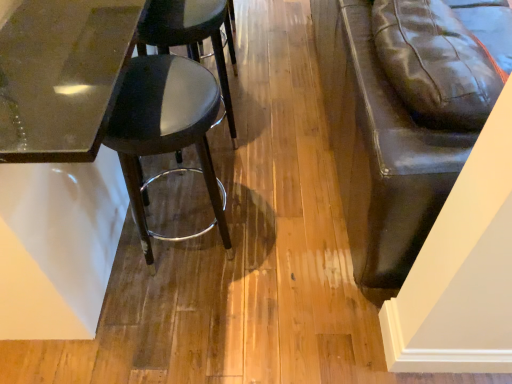
Question: Is the depth of glossy glass table at upper left less than that of matte black stool at left, which is the first stool from bottom to top?

Choices:
 (A) yes
 (B) no

Answer: (A)

Question: Is glossy glass table at upper left bigger than matte black stool at left, which is the first stool from bottom to top?

Choices:
 (A) no
 (B) yes

Answer: (B)

Question: From a real-world perspective, is glossy glass table at upper left beneath matte black stool at left, the 2th stool from the top?

Choices:
 (A) yes
 (B) no

Answer: (B)

Question: Does glossy glass table at upper left have a greater height compared to matte black stool at left, the 2th stool from the top?

Choices:
 (A) no
 (B) yes

Answer: (B)

Question: Is glossy glass table at upper left positioned behind matte black stool at left, the 2th stool from the top?

Choices:
 (A) yes
 (B) no

Answer: (B)

Question: Considering their positions, is black leather stool at center, positioned as the 1th stool in top-to-bottom order, located in front of or behind matte black stool at left, which is the first stool from bottom to top?

Choices:
 (A) behind
 (B) front

Answer: (A)

Question: Looking at the image, does black leather stool at center, positioned as the 1th stool in top-to-bottom order, seem bigger or smaller compared to matte black stool at left, which is the first stool from bottom to top?

Choices:
 (A) big
 (B) small

Answer: (A)

Question: Based on their positions, is black leather stool at center, positioned as the 1th stool in top-to-bottom order, located to the left or right of matte black stool at left, which is the first stool from bottom to top?

Choices:
 (A) left
 (B) right

Answer: (A)

Question: Considering the positions of black leather stool at center, the second stool from the bottom, and matte black stool at left, which is the first stool from bottom to top, in the image, is black leather stool at center, the second stool from the bottom, taller or shorter than matte black stool at left, which is the first stool from bottom to top,?

Choices:
 (A) tall
 (B) short

Answer: (A)

Question: Based on their sizes in the image, would you say black leather stool at center, the second stool from the bottom, is bigger or smaller than glossy glass table at upper left?

Choices:
 (A) big
 (B) small

Answer: (B)

Question: Is black leather stool at center, the second stool from the bottom, wider or thinner than glossy glass table at upper left?

Choices:
 (A) thin
 (B) wide

Answer: (A)

Question: From the image's perspective, is black leather stool at center, positioned as the 1th stool in top-to-bottom order, located above or below glossy glass table at upper left?

Choices:
 (A) above
 (B) below

Answer: (B)

Question: Is black leather stool at center, the second stool from the bottom, situated inside glossy glass table at upper left or outside?

Choices:
 (A) outside
 (B) inside

Answer: (B)

Question: Is matte black stool at left, the 2th stool from the top, spatially inside glossy glass table at upper left, or outside of it?

Choices:
 (A) outside
 (B) inside

Answer: (B)

Question: Does point (138, 137) appear closer or farther from the camera than point (8, 0)?

Choices:
 (A) closer
 (B) farther

Answer: (A)